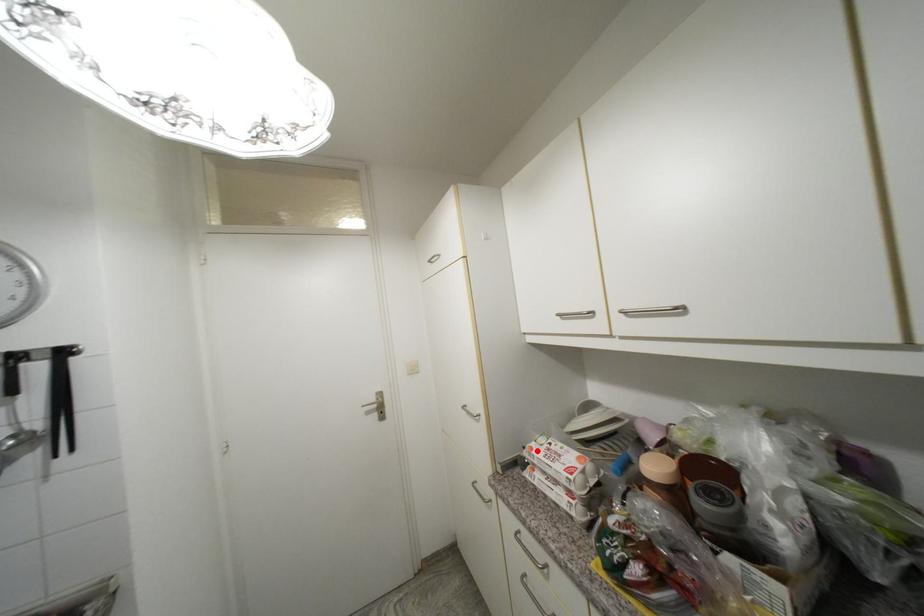
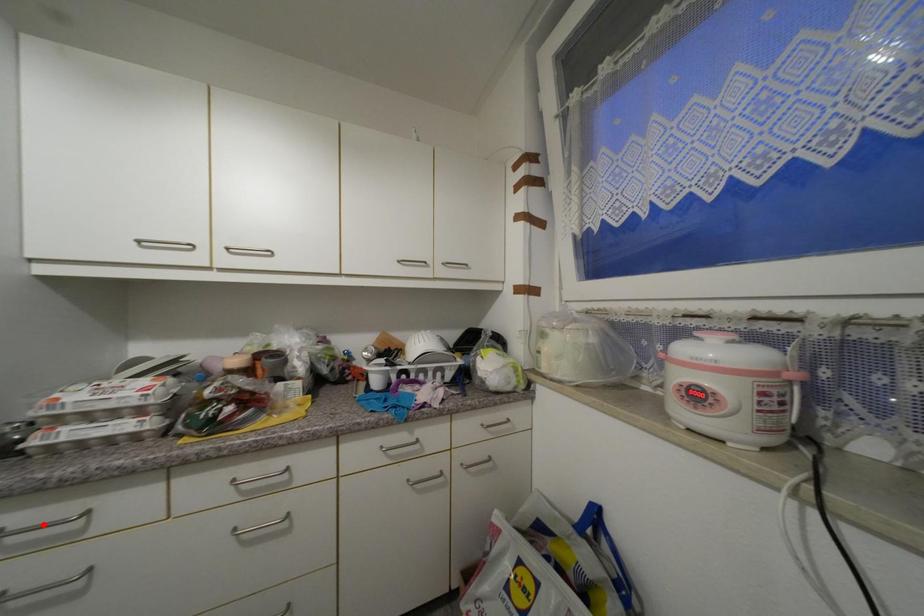
I am providing you with two images of the same scene from different viewpoints. A red point is marked on the first image and another point is marked on the second image. Are the points marked in image1 and image2 representing the same 3D position?

No